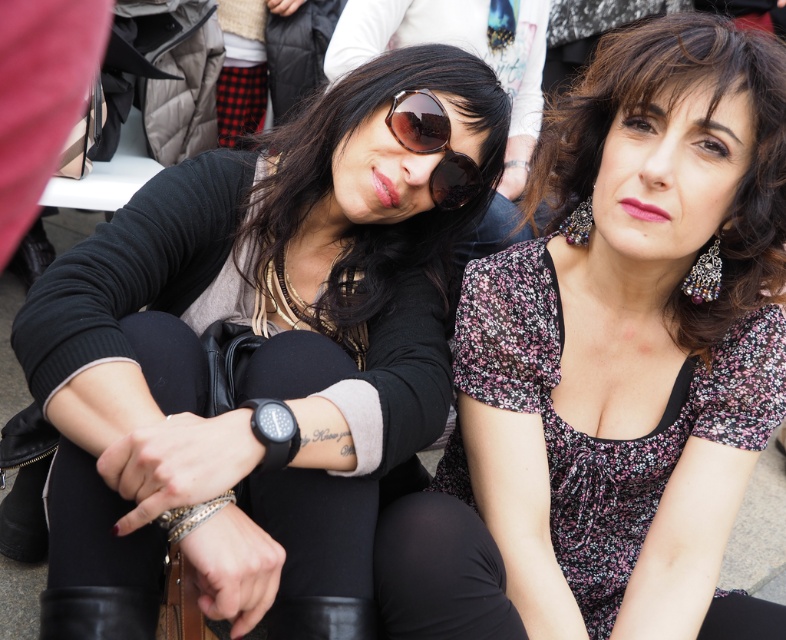
Question: Which point is farther to the camera?

Choices:
 (A) (333, 608)
 (B) (123, 609)
 (C) (347, 81)
 (D) (634, 104)

Answer: (C)

Question: In this image, where is floral-patterned fabric top at center located relative to black leather boot at lower left?

Choices:
 (A) left
 (B) right

Answer: (B)

Question: Can you confirm if matte black sweater at left is positioned above sunglasses at center?

Choices:
 (A) no
 (B) yes

Answer: (A)

Question: Which point is farther to the camera?

Choices:
 (A) sunglasses at center
 (B) black leather boot at lower left

Answer: (A)

Question: Is matte black sunglasses at center closer to camera compared to sunglasses at center?

Choices:
 (A) no
 (B) yes

Answer: (A)

Question: Which point appears farthest from the camera in this image?

Choices:
 (A) (450, 166)
 (B) (750, 35)
 (C) (333, 589)
 (D) (336, 132)

Answer: (D)